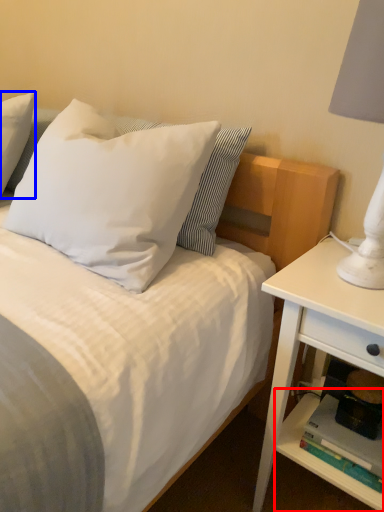
Question: Among these objects, which one is farthest to the camera, shelf (highlighted by a red box) or pillow (highlighted by a blue box)?

Choices:
 (A) shelf
 (B) pillow

Answer: (B)